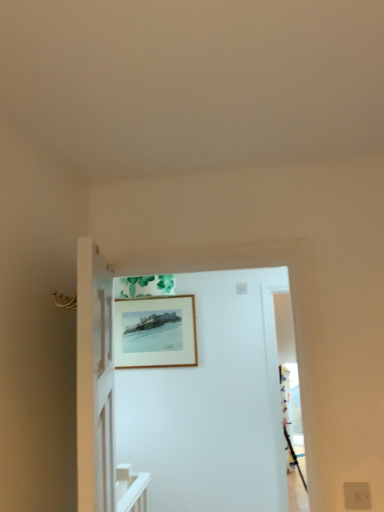
Question: In the image, is white matte electric outlet at lower right positioned in front of or behind wooden picture frame at upper center?

Choices:
 (A) behind
 (B) front

Answer: (B)

Question: Considering the positions of white matte electric outlet at lower right and wooden picture frame at upper center in the image, is white matte electric outlet at lower right taller or shorter than wooden picture frame at upper center?

Choices:
 (A) tall
 (B) short

Answer: (B)

Question: Estimate the real-world distances between objects in this image. Which object is farther from the white wooden door at center?

Choices:
 (A) white matte electric outlet at lower right
 (B) wooden picture frame at upper center

Answer: (A)

Question: Based on their relative distances, which object is farther from the white wooden door at center?

Choices:
 (A) wooden picture frame at upper center
 (B) white matte electric outlet at lower right

Answer: (B)